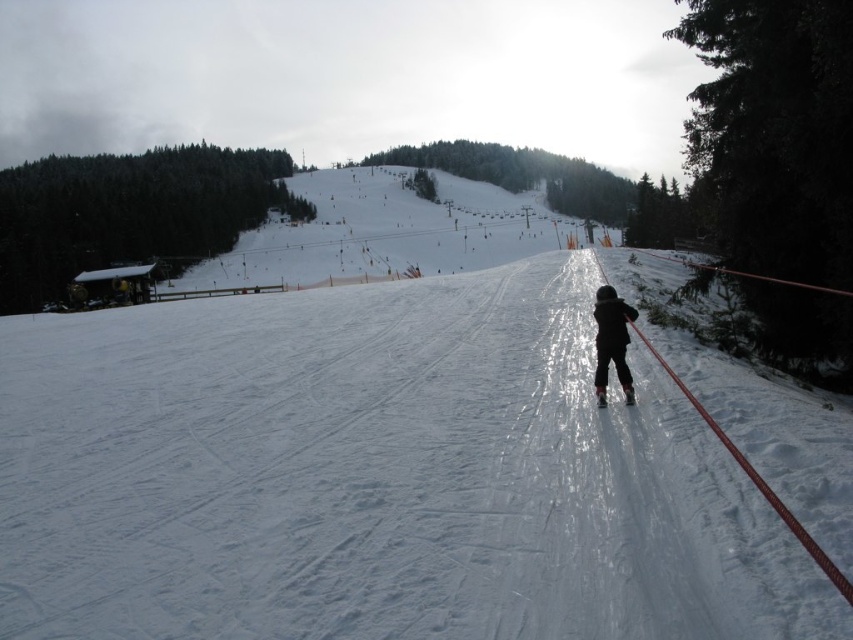
Question: Which object is positioned farthest from the black matte snowsuit at center?

Choices:
 (A) matte black ski at center
 (B) white smooth snow at center

Answer: (B)

Question: Among these points, which one is nearest to the camera?

Choices:
 (A) (515, 513)
 (B) (625, 396)

Answer: (A)

Question: Is white smooth snow at center further to the viewer compared to black matte snowsuit at center?

Choices:
 (A) yes
 (B) no

Answer: (B)

Question: Does white smooth snow at center appear on the left side of black matte snowsuit at center?

Choices:
 (A) yes
 (B) no

Answer: (A)

Question: Which of the following is the closest to the observer?

Choices:
 (A) black matte snowsuit at center
 (B) matte black ski at center
 (C) white smooth snow at center

Answer: (C)

Question: Can you confirm if black matte snowsuit at center is positioned to the right of matte black ski at center?

Choices:
 (A) no
 (B) yes

Answer: (B)